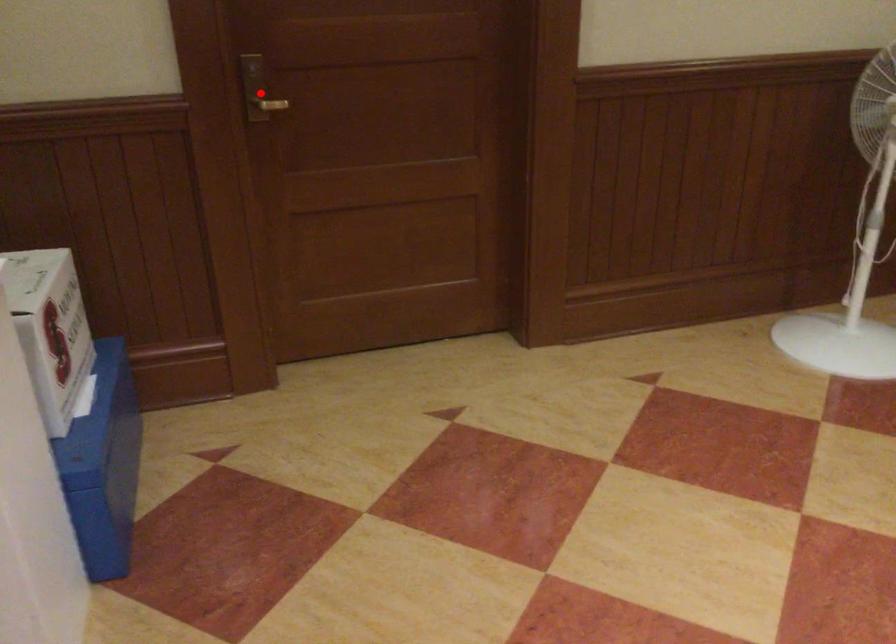
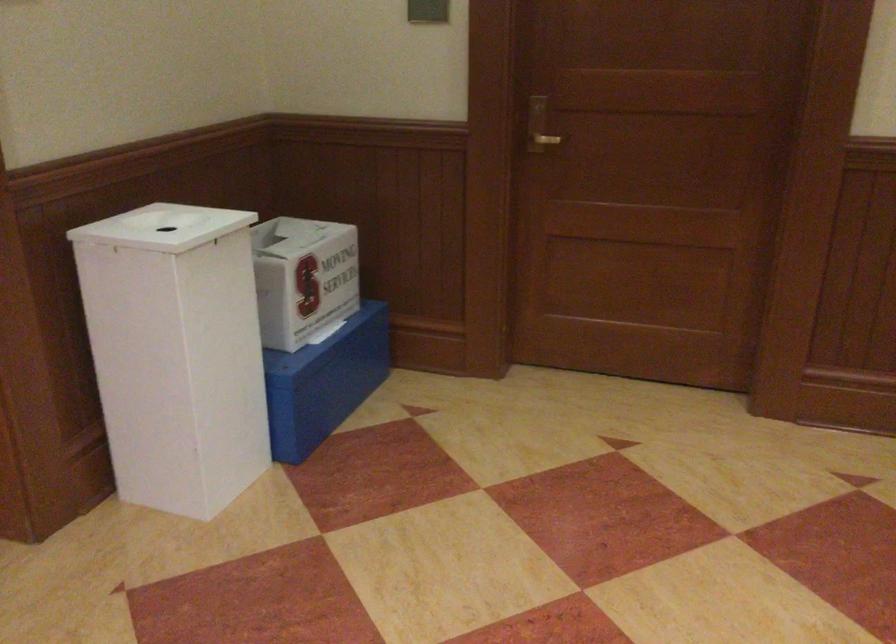
Question: A red point is marked in image1. In image2, is the corresponding 3D point closer to the camera or farther? Reply with the corresponding letter.

Choices:
 (A) The corresponding 3D point is closer.
 (B) The corresponding 3D point is farther.

Answer: (B)